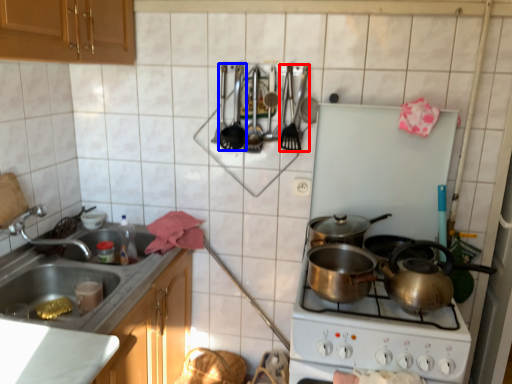
Question: Which object is closer to the camera taking this photo, silverware (highlighted by a red box) or appliance (highlighted by a blue box)?

Choices:
 (A) silverware
 (B) appliance

Answer: (A)